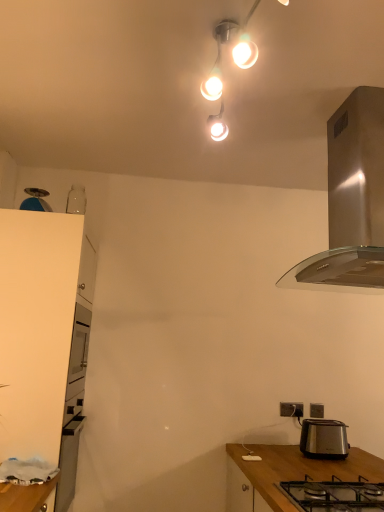
The height and width of the screenshot is (512, 384). What do you see at coordinates (291, 409) in the screenshot?
I see `black plastic power outlet at lower right, arranged as the 1th power outlet when viewed from the left` at bounding box center [291, 409].

You are a GUI agent. You are given a task and a screenshot of the screen. Output one action in this format:
    pyautogui.click(x=<x>, y=<y>)
    Task: Click on the matte white light fixture at upper center
    This screenshot has height=512, width=384.
    Given the screenshot: What is the action you would take?
    pyautogui.click(x=232, y=52)

Identify the location of black plastic power outlet at lower right, arranged as the 1th power outlet when viewed from the left. This screenshot has width=384, height=512. (291, 409).

From a real-world perspective, is satin silver range hood at upper right above or below matte white light fixture at upper center?

Clearly, from a real-world perspective, satin silver range hood at upper right is below matte white light fixture at upper center.

Is satin silver range hood at upper right directly adjacent to matte white light fixture at upper center?

No.

Is the depth of satin silver range hood at upper right less than that of matte white light fixture at upper center?

No, satin silver range hood at upper right is further to the viewer.

Would you say satin silver range hood at upper right contains matte white light fixture at upper center?

No.

From the image's perspective, which one is positioned lower, black metal/glass gas stove at lower center or satin silver range hood at upper right?

From the image's view, black metal/glass gas stove at lower center is below.

Considering the sizes of objects black metal/glass gas stove at lower center and satin silver range hood at upper right in the image provided, who is smaller, black metal/glass gas stove at lower center or satin silver range hood at upper right?

black metal/glass gas stove at lower center.

How much distance is there between black metal/glass gas stove at lower center and satin silver range hood at upper right?

black metal/glass gas stove at lower center and satin silver range hood at upper right are 1.00 meters apart.

Measure the distance between satin silver range hood at upper right and matte black power outlet at lower right, acting as the 2th power outlet starting from the left.

satin silver range hood at upper right is 4.72 feet away from matte black power outlet at lower right, acting as the 2th power outlet starting from the left.

Does satin silver range hood at upper right have a greater height compared to matte black power outlet at lower right, acting as the 2th power outlet starting from the left?

Indeed, satin silver range hood at upper right has a greater height compared to matte black power outlet at lower right, acting as the 2th power outlet starting from the left.

At what (x,y) coordinates should I click in order to perform the action: click on the 2nd power outlet located beneath the satin silver range hood at upper right (from a real-world perspective). Please return your answer as a coordinate pair (x, y). This screenshot has width=384, height=512. Looking at the image, I should click on (316, 410).

From a real-world perspective, is satin silver range hood at upper right beneath matte black power outlet at lower right, acting as the 2th power outlet starting from the left?

No, from a real-world perspective, satin silver range hood at upper right is not beneath matte black power outlet at lower right, acting as the 2th power outlet starting from the left.

Could you tell me if matte black power outlet at lower right, acting as the 2th power outlet starting from the left, is turned towards black plastic power outlet at lower right, arranged as the 1th power outlet when viewed from the left?

No, matte black power outlet at lower right, acting as the 2th power outlet starting from the left, is not turned towards black plastic power outlet at lower right, arranged as the 1th power outlet when viewed from the left.

Looking at this image, from the image's perspective, between matte black power outlet at lower right, acting as the 2th power outlet starting from the left, and black plastic power outlet at lower right, arranged as the 1th power outlet when viewed from the left, which one is located above?

black plastic power outlet at lower right, arranged as the 1th power outlet when viewed from the left.

Would you consider matte black power outlet at lower right, acting as the 2th power outlet starting from the left, to be distant from black plastic power outlet at lower right, acting as the 2th power outlet starting from the right?

No.

Which of these two, matte black power outlet at lower right, acting as the 2th power outlet starting from the left, or black plastic power outlet at lower right, arranged as the 1th power outlet when viewed from the left, is wider?

Wider between the two is black plastic power outlet at lower right, arranged as the 1th power outlet when viewed from the left.

Considering the relative sizes of black plastic power outlet at lower right, arranged as the 1th power outlet when viewed from the left, and satin silver toaster at lower right in the image provided, is black plastic power outlet at lower right, arranged as the 1th power outlet when viewed from the left, smaller than satin silver toaster at lower right?

Yes, black plastic power outlet at lower right, arranged as the 1th power outlet when viewed from the left, is smaller than satin silver toaster at lower right.

Could you tell me if black plastic power outlet at lower right, acting as the 2th power outlet starting from the right, is facing satin silver toaster at lower right?

Yes, black plastic power outlet at lower right, acting as the 2th power outlet starting from the right, faces towards satin silver toaster at lower right.

From the image's perspective, does black plastic power outlet at lower right, acting as the 2th power outlet starting from the right, appear lower than satin silver toaster at lower right?

Actually, black plastic power outlet at lower right, acting as the 2th power outlet starting from the right, appears above satin silver toaster at lower right in the image.

Considering the relative sizes of white matte cabinet at left and matte black power outlet at lower right, acting as the 2th power outlet starting from the left, in the image provided, is white matte cabinet at left smaller than matte black power outlet at lower right, acting as the 2th power outlet starting from the left,?

No, white matte cabinet at left is not smaller than matte black power outlet at lower right, acting as the 2th power outlet starting from the left.

Is white matte cabinet at left facing towards matte black power outlet at lower right, acting as the 2th power outlet starting from the left?

A: Yes.

Considering the relative sizes of white matte cabinet at left and matte black power outlet at lower right, which is the 1th power outlet from right to left, in the image provided, is white matte cabinet at left thinner than matte black power outlet at lower right, which is the 1th power outlet from right to left,?

No.

From a real-world perspective, which object stands above the other?

In real-world perspective, white matte cabinet at left is above.

Is black metal/glass gas stove at lower center outside of matte black power outlet at lower right, which is the 1th power outlet from right to left?

black metal/glass gas stove at lower center lies outside matte black power outlet at lower right, which is the 1th power outlet from right to left,'s area.

Can you confirm if black metal/glass gas stove at lower center is bigger than matte black power outlet at lower right, acting as the 2th power outlet starting from the left?

Yes.

Locate an element on the screen. gas stove below the matte black power outlet at lower right, which is the 1th power outlet from right to left (from a real-world perspective) is located at coordinates (334, 495).

Is there a large distance between black metal/glass gas stove at lower center and matte black power outlet at lower right, which is the 1th power outlet from right to left?

Indeed, black metal/glass gas stove at lower center is not near matte black power outlet at lower right, which is the 1th power outlet from right to left.

At what (x,y) coordinates should I click in order to perform the action: click on kitchen appliance behind the matte white light fixture at upper center. Please return your answer as a coordinate pair (x, y). This screenshot has width=384, height=512. Looking at the image, I should click on (351, 202).

At what (x,y) coordinates should I click in order to perform the action: click on gas stove in front of the satin silver range hood at upper right. Please return your answer as a coordinate pair (x, y). This screenshot has height=512, width=384. Looking at the image, I should click on (334, 495).

When comparing their distances from matte black power outlet at lower right, which is the 1th power outlet from right to left, does black plastic power outlet at lower right, arranged as the 1th power outlet when viewed from the left, or black metal/glass gas stove at lower center seem closer?

Based on the image, black plastic power outlet at lower right, arranged as the 1th power outlet when viewed from the left, appears to be nearer to matte black power outlet at lower right, which is the 1th power outlet from right to left.

When comparing their distances from black plastic power outlet at lower right, acting as the 2th power outlet starting from the right, does satin silver range hood at upper right or black metal/glass gas stove at lower center seem closer?

black metal/glass gas stove at lower center.

Considering their positions, is matte black power outlet at lower right, acting as the 2th power outlet starting from the left, positioned closer to black metal/glass gas stove at lower center than matte white light fixture at upper center?

Based on the image, matte black power outlet at lower right, acting as the 2th power outlet starting from the left, appears to be nearer to black metal/glass gas stove at lower center.

When comparing their distances from white matte cabinet at left, does satin silver range hood at upper right or matte black power outlet at lower right, which is the 1th power outlet from right to left, seem further?

matte black power outlet at lower right, which is the 1th power outlet from right to left, is positioned further to the anchor white matte cabinet at left.

Considering their positions, is satin silver toaster at lower right positioned further to black plastic power outlet at lower right, acting as the 2th power outlet starting from the right, than satin silver range hood at upper right?

satin silver range hood at upper right is positioned further to the anchor black plastic power outlet at lower right, acting as the 2th power outlet starting from the right.

Which object lies further to the anchor point satin silver range hood at upper right, matte white light fixture at upper center or black metal/glass gas stove at lower center?

The object further to satin silver range hood at upper right is black metal/glass gas stove at lower center.

Based on their spatial positions, is satin silver toaster at lower right or white matte cabinet at left closer to matte black power outlet at lower right, acting as the 2th power outlet starting from the left?

satin silver toaster at lower right is positioned closer to the anchor matte black power outlet at lower right, acting as the 2th power outlet starting from the left.

From the image, which object appears to be farther from satin silver range hood at upper right, black plastic power outlet at lower right, arranged as the 1th power outlet when viewed from the left, or matte white light fixture at upper center?

black plastic power outlet at lower right, arranged as the 1th power outlet when viewed from the left, is further to satin silver range hood at upper right.

The width and height of the screenshot is (384, 512). What are the coordinates of `gas stove between white matte cabinet at left and satin silver toaster at lower right` in the screenshot? It's located at (334, 495).

Locate an element on the screen. cabinetry between matte white light fixture at upper center and satin silver toaster at lower right in the vertical direction is located at coordinates (36, 328).

The width and height of the screenshot is (384, 512). Find the location of `toaster located between black metal/glass gas stove at lower center and black plastic power outlet at lower right, arranged as the 1th power outlet when viewed from the left, in the depth direction`. toaster located between black metal/glass gas stove at lower center and black plastic power outlet at lower right, arranged as the 1th power outlet when viewed from the left, in the depth direction is located at coordinates (324, 439).

Identify the location of cabinetry between matte white light fixture at upper center and black plastic power outlet at lower right, arranged as the 1th power outlet when viewed from the left, in the up-down direction. (36, 328).